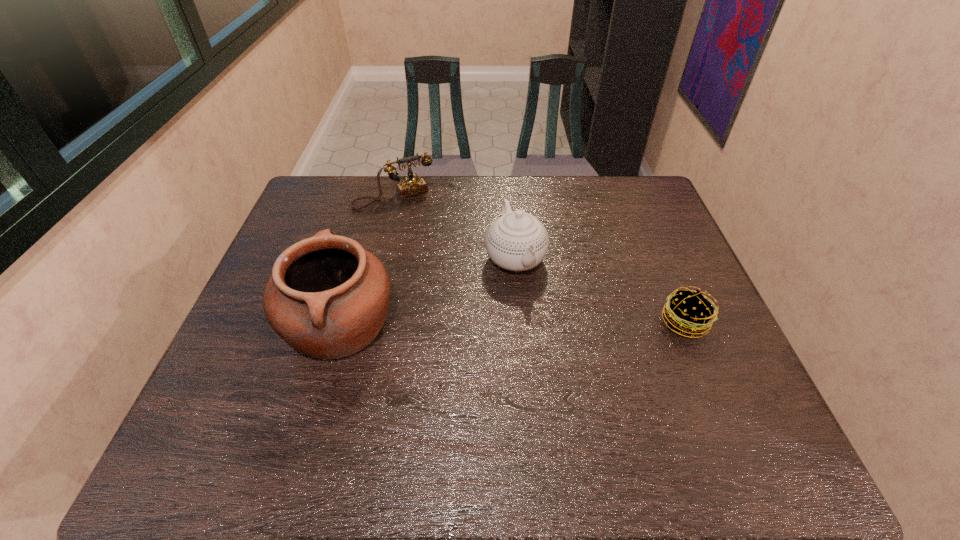
Locate an element on the screen. The width and height of the screenshot is (960, 540). vacant space at the left edge of the desktop is located at coordinates (231, 369).

You are a GUI agent. You are given a task and a screenshot of the screen. Output one action in this format:
    pyautogui.click(x=<x>, y=<y>)
    Task: Click on the blank space at the right edge of the desktop
    Image resolution: width=960 pixels, height=540 pixels.
    Given the screenshot: What is the action you would take?
    pyautogui.click(x=685, y=369)

In the image, there is a desktop. Where is `vacant space at the far left corner`? vacant space at the far left corner is located at coordinates coord(335,200).

The image size is (960, 540). What are the coordinates of `free space at the near left corner of the desktop` in the screenshot? It's located at (195, 416).

You are a GUI agent. You are given a task and a screenshot of the screen. Output one action in this format:
    pyautogui.click(x=<x>, y=<y>)
    Task: Click on the free spot at the far right corner of the desktop
    
    Given the screenshot: What is the action you would take?
    pyautogui.click(x=641, y=199)

This screenshot has width=960, height=540. I want to click on free space between the third shortest object and the rightmost object, so click(600, 290).

The width and height of the screenshot is (960, 540). I want to click on free space between the second shortest object and the chinaware, so click(x=455, y=227).

This screenshot has height=540, width=960. I want to click on free space between the third shortest object and the tallest object, so coord(428,292).

Identify the location of empty location between the chinaware and the second shortest object. tap(455, 227).

Where is `empty space that is in between the pottery and the rightmost object`? empty space that is in between the pottery and the rightmost object is located at coordinates (513, 323).